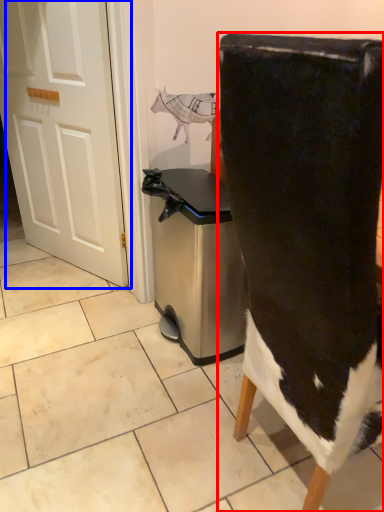
Question: Which of the following is the closest to the observer, chair (highlighted by a red box) or door (highlighted by a blue box)?

Choices:
 (A) chair
 (B) door

Answer: (A)